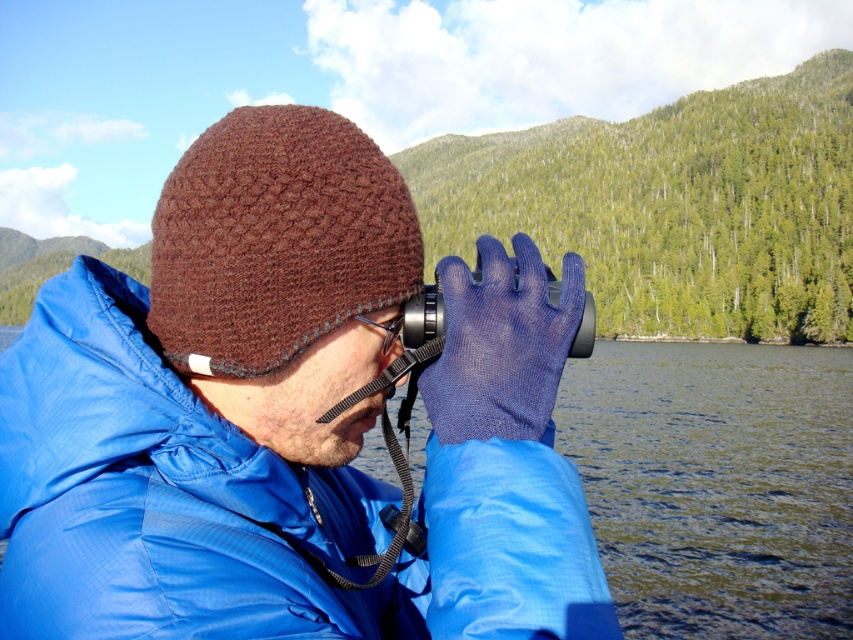
Is brown knitted hat at upper center taller than brown knitted hat at upper left?

Yes.

The width and height of the screenshot is (853, 640). Identify the location of brown knitted hat at upper center. (287, 417).

Which is behind, point (338, 236) or point (390, 321)?

The point (390, 321) is more distant.

Between brown knitted hat at upper left and black rubber goggles at center, which one appears on the left side from the viewer's perspective?

Positioned to the left is black rubber goggles at center.

The width and height of the screenshot is (853, 640). Describe the element at coordinates (276, 240) in the screenshot. I see `brown knitted hat at upper left` at that location.

This screenshot has width=853, height=640. Find the location of `brown knitted hat at upper left`. brown knitted hat at upper left is located at coordinates (276, 240).

Measure the distance from brown knitted hat at upper center to black rubber goggles at center.

The distance of brown knitted hat at upper center from black rubber goggles at center is 3.43 feet.

Is brown knitted hat at upper center above black rubber goggles at center?

Actually, brown knitted hat at upper center is below black rubber goggles at center.

Where is `brown knitted hat at upper center`? The image size is (853, 640). brown knitted hat at upper center is located at coordinates (287, 417).